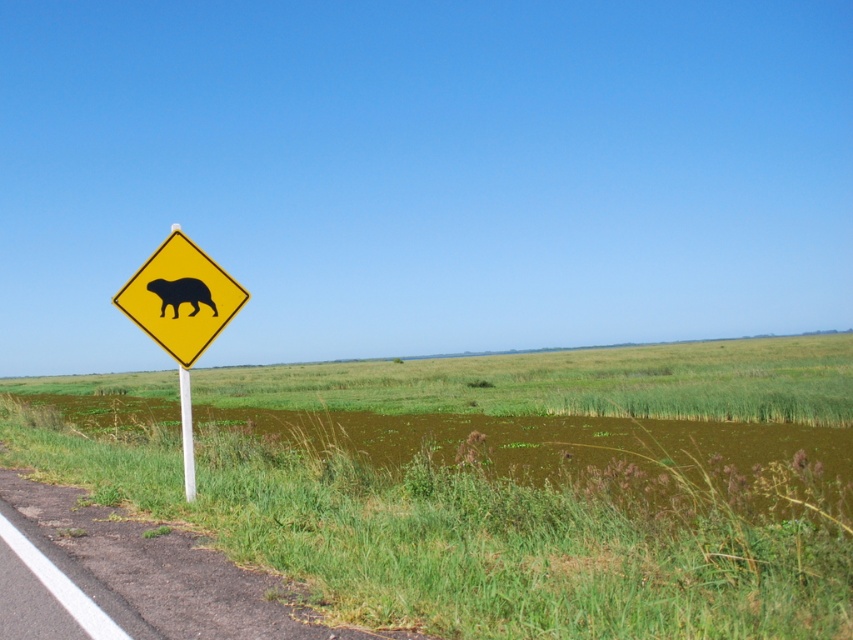
Is yellow plastic diamond at left further to camera compared to black matte bear at left?

No, yellow plastic diamond at left is in front of black matte bear at left.

Locate an element on the screen. yellow plastic diamond at left is located at coordinates (180, 298).

Image resolution: width=853 pixels, height=640 pixels. I want to click on yellow plastic diamond at left, so click(180, 298).

Who is shorter, yellow plastic diamond at left or white plastic pole at left?

yellow plastic diamond at left

In the scene shown: Does yellow plastic diamond at left appear under white plastic pole at left?

Incorrect, yellow plastic diamond at left is not positioned below white plastic pole at left.

Who is more forward, (202, 285) or (181, 368)?

Point (181, 368) is more forward.

This screenshot has height=640, width=853. Find the location of `yellow plastic diamond at left`. yellow plastic diamond at left is located at coordinates (180, 298).

Does black matte bear at left lie behind white plastic pole at left?

That is True.

Is black matte bear at left to the left of white plastic pole at left from the viewer's perspective?

No, black matte bear at left is not to the left of white plastic pole at left.

Find the location of `black matte bear at left`. black matte bear at left is located at coordinates (181, 294).

Find the location of a particular element. black matte bear at left is located at coordinates (181, 294).